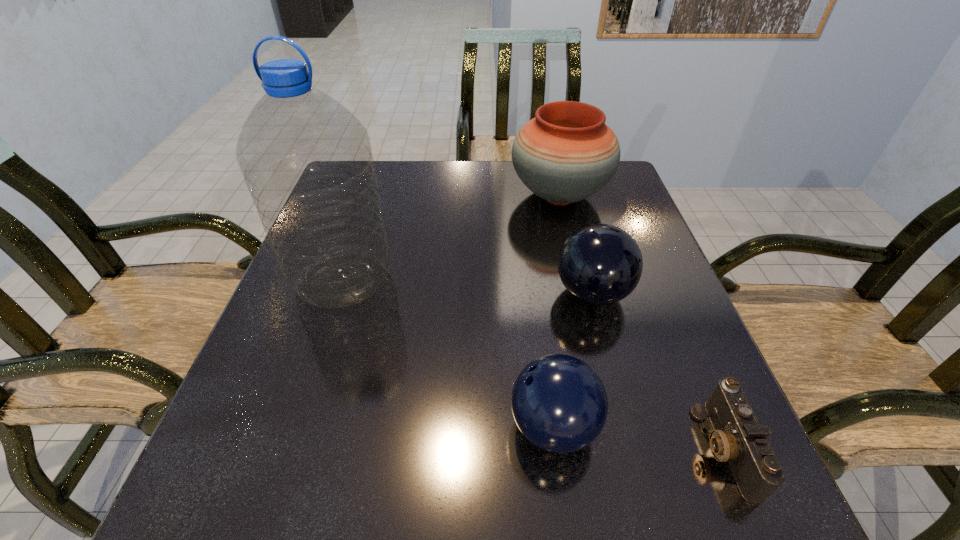
Where is `water jug`? The width and height of the screenshot is (960, 540). water jug is located at coordinates (307, 161).

Identify the location of the leftmost object. The width and height of the screenshot is (960, 540). (307, 161).

Where is `the farthest object`? the farthest object is located at coordinates (567, 153).

What are the coordinates of `pottery` in the screenshot? It's located at (567, 153).

The width and height of the screenshot is (960, 540). In order to click on the farther bowling ball in this screenshot , I will do `click(600, 264)`.

Locate an element on the screen. The height and width of the screenshot is (540, 960). the nearer bowling ball is located at coordinates (559, 403).

Image resolution: width=960 pixels, height=540 pixels. In order to click on camera in this screenshot , I will do `click(738, 438)`.

Find the location of a particular element. free point located on the right of the water jug is located at coordinates (574, 280).

This screenshot has width=960, height=540. What are the coordinates of `vacant area located on the left of the pottery` in the screenshot? It's located at (x=469, y=195).

Identify the location of free point located 0.220m on the side of the farther bowling ball with the finger holes. The width and height of the screenshot is (960, 540). (451, 294).